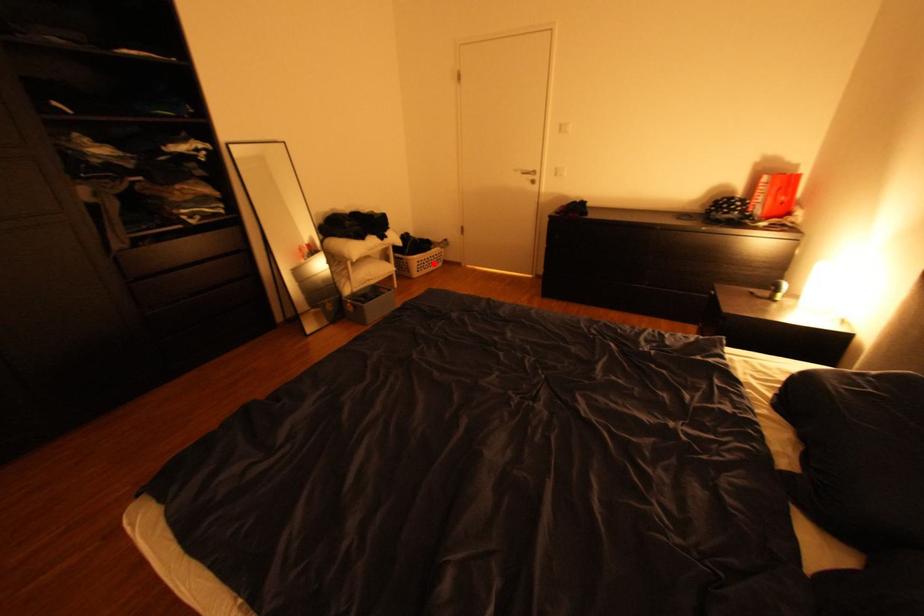
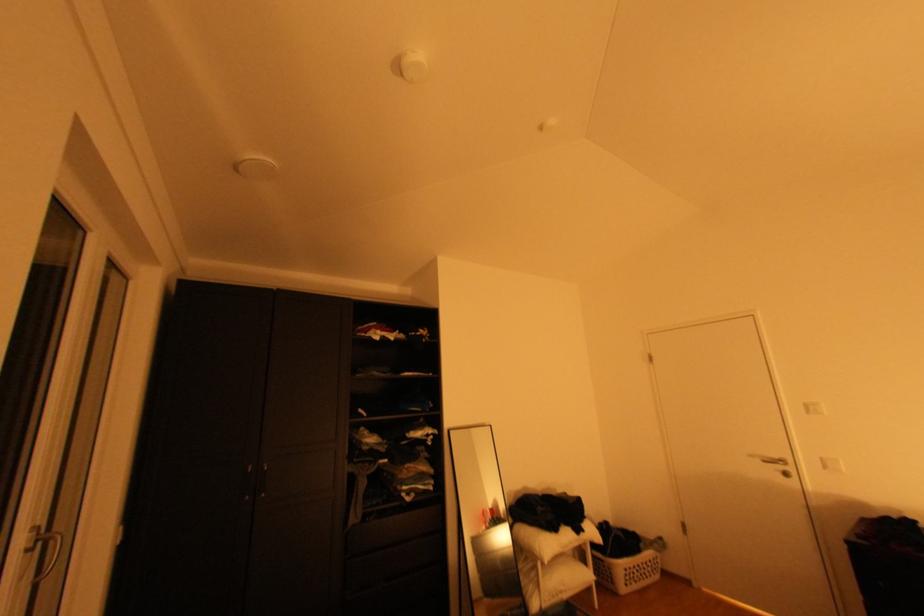
Find the pixel in the second image that matches the highlighted location in the first image.

(642, 573)